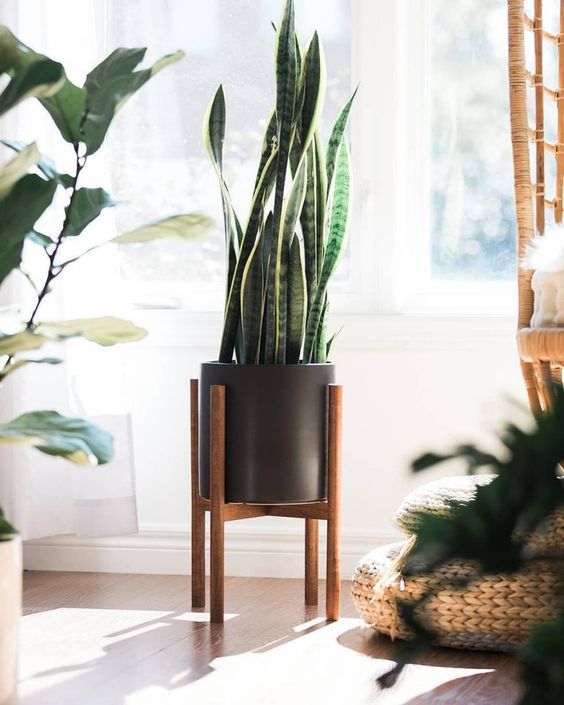
Locate an element on the screen. This screenshot has width=564, height=705. 2 sides to a window is located at coordinates (464, 159), (171, 164).